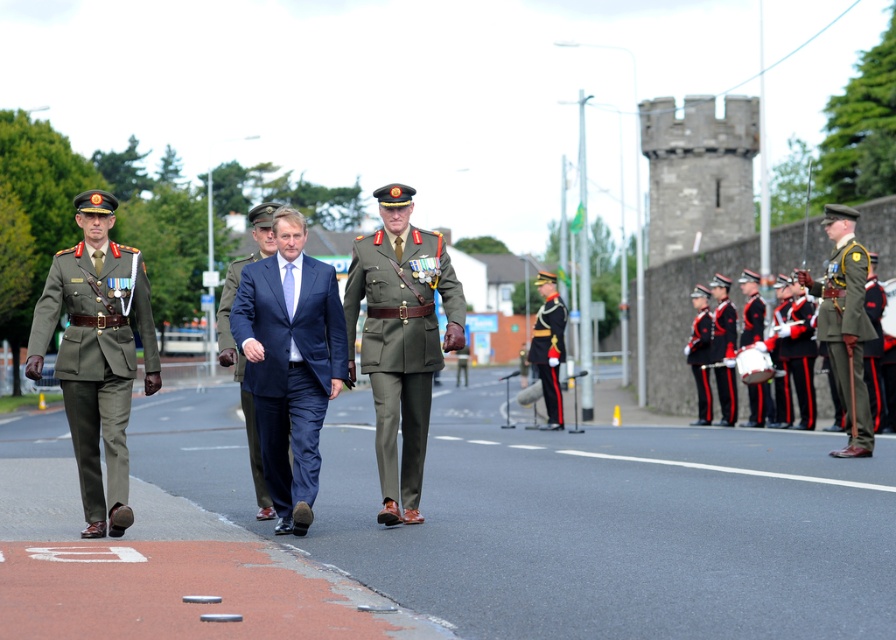
From the picture: You are part of the ceremonial procession and need to move from the point at coordinates point [356,296] to the point at coordinates point [251,417]. Which direction should you move to reach your destination?

You should move backward because point [356,296] is in front of point [251,417], so moving backward will take you towards the destination.

You are standing at the center of the road and see the point marked as point [97,353]. Which direction should you walk to reach the matte olive green uniform at left?

The point [97,353] represents the matte olive green uniform at left, so you are already at the direction of the matte olive green uniform at left.